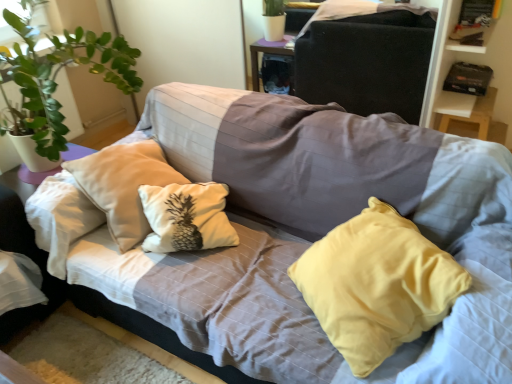
Find the location of a particular element. matte fabric couch at upper center is located at coordinates (367, 62).

I want to click on matte fabric couch at upper center, so (x=367, y=62).

Between black cardboard box at upper right and yellow fabric pillow at center, which one has larger size?

With larger size is yellow fabric pillow at center.

Is black cardboard box at upper right positioned with its back to yellow fabric pillow at center?

No.

Is black cardboard box at upper right situated inside yellow fabric pillow at center or outside?

The correct answer is: outside.

From the image's perspective, is black cardboard box at upper right under yellow fabric pillow at center?

Actually, black cardboard box at upper right appears above yellow fabric pillow at center in the image.

How distant is matte fabric couch at upper center from yellow fabric pillow at center?

A distance of 6.34 feet exists between matte fabric couch at upper center and yellow fabric pillow at center.

You are a GUI agent. You are given a task and a screenshot of the screen. Output one action in this format:
    pyautogui.click(x=<x>, y=<y>)
    Task: Click on the gray that is behind the yellow fabric pillow at center
    This screenshot has height=384, width=512.
    Given the screenshot: What is the action you would take?
    pyautogui.click(x=367, y=62)

Between matte fabric couch at upper center and yellow fabric pillow at center, which one appears on the left side from the viewer's perspective?

From the viewer's perspective, yellow fabric pillow at center appears more on the left side.

Is matte fabric couch at upper center in front of or behind yellow fabric pillow at center in the image?

Visually, matte fabric couch at upper center is located behind yellow fabric pillow at center.

Between matte fabric couch at upper center and black cardboard box at upper right, which one appears on the left side from the viewer's perspective?

matte fabric couch at upper center is more to the left.

In the image, is matte fabric couch at upper center positioned in front of or behind black cardboard box at upper right?

In the image, matte fabric couch at upper center appears behind black cardboard box at upper right.

Can you tell me how much matte fabric couch at upper center and black cardboard box at upper right differ in facing direction?

The angular difference between matte fabric couch at upper center and black cardboard box at upper right is 91 degrees.

Is matte fabric couch at upper center completely or partially outside of black cardboard box at upper right?

Indeed, matte fabric couch at upper center is completely outside black cardboard box at upper right.

Is yellow fabric pillow at center inside or outside of matte fabric couch at upper center?

yellow fabric pillow at center is not enclosed by matte fabric couch at upper center.

Is yellow fabric pillow at center at the right side of matte fabric couch at upper center?

In fact, yellow fabric pillow at center is to the left of matte fabric couch at upper center.

Is yellow fabric pillow at center wider than matte fabric couch at upper center?

Indeed, yellow fabric pillow at center has a greater width compared to matte fabric couch at upper center.

Is yellow fabric pillow at center facing away from matte fabric couch at upper center?

That's not correct — yellow fabric pillow at center is not looking away from matte fabric couch at upper center.

From the image's perspective, is yellow fabric pillow at center above or below black cardboard box at upper right?

From the image's perspective, yellow fabric pillow at center appears below black cardboard box at upper right.

Is yellow fabric pillow at center bigger than black cardboard box at upper right?

Correct, yellow fabric pillow at center is larger in size than black cardboard box at upper right.

Is point (507, 27) closer or farther from the camera than point (336, 73)?

Clearly, point (507, 27) is closer to the camera than point (336, 73).

Locate an element on the screen. This screenshot has height=384, width=512. gray behind the black cardboard box at upper right is located at coordinates (367, 62).

Based on their sizes in the image, would you say black cardboard box at upper right is bigger or smaller than matte fabric couch at upper center?

Considering their sizes, black cardboard box at upper right takes up more space than matte fabric couch at upper center.

Which object is more forward, black cardboard box at upper right or matte fabric couch at upper center?

black cardboard box at upper right.

Locate an element on the screen. Image resolution: width=512 pixels, height=384 pixels. bookshelf above the yellow fabric pillow at center (from a real-world perspective) is located at coordinates (471, 60).

In order to click on gray behind the yellow fabric pillow at center in this screenshot , I will do `click(367, 62)`.

Looking at this image, looking at the image, which one is located further to yellow fabric pillow at center, matte fabric couch at upper center or black cardboard box at upper right?

Based on the image, matte fabric couch at upper center appears to be further to yellow fabric pillow at center.

Estimate the real-world distances between objects in this image. Which object is closer to yellow fabric pillow at center, black cardboard box at upper right or matte fabric couch at upper center?

The object closer to yellow fabric pillow at center is black cardboard box at upper right.

When comparing their distances from black cardboard box at upper right, does yellow fabric pillow at center or matte fabric couch at upper center seem further?

yellow fabric pillow at center is further to black cardboard box at upper right.

From the image, which object appears to be farther from matte fabric couch at upper center, black cardboard box at upper right or yellow fabric pillow at center?

yellow fabric pillow at center is positioned further to the anchor matte fabric couch at upper center.

From the image, which object appears to be farther from black cardboard box at upper right, matte fabric couch at upper center or yellow fabric pillow at center?

Based on the image, yellow fabric pillow at center appears to be further to black cardboard box at upper right.

Estimate the real-world distances between objects in this image. Which object is closer to matte fabric couch at upper center, yellow fabric pillow at center or black cardboard box at upper right?

black cardboard box at upper right is positioned closer to the anchor matte fabric couch at upper center.

Where is `bookshelf between yellow fabric pillow at center and matte fabric couch at upper center from front to back`? The height and width of the screenshot is (384, 512). bookshelf between yellow fabric pillow at center and matte fabric couch at upper center from front to back is located at coordinates (471, 60).